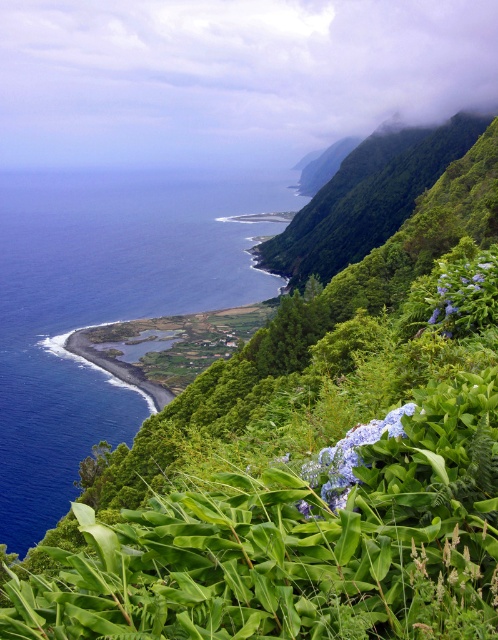
You are a hiker who wants to take a photo of the purple matte hydrangea at right and the deep blue water at left. Which object should you move closer to in order to capture both in the same frame?

To capture both the purple matte hydrangea at right and the deep blue water at left in the same frame, you should move closer to the purple matte hydrangea at right since the deep blue water at left is larger and might already occupy more of the frame.

From the picture: You are standing in the coastal landscape and see both the purple matte hydrangea at right and the blue matte hydrangea at center. Which hydrangea is positioned more to the east?

The purple matte hydrangea at right is positioned more to the east because it is to the right of the blue matte hydrangea at center, and assuming the image is oriented with east to the right.

You are standing at the point with coordinates point [20,266] and want to walk towards point [378,424]. Which direction should you move relative to your current position?

You should move away from the viewer because point [20,266] is closer to the viewer than point [378,424]. So moving towards point [378,424] would require moving away from the viewer.